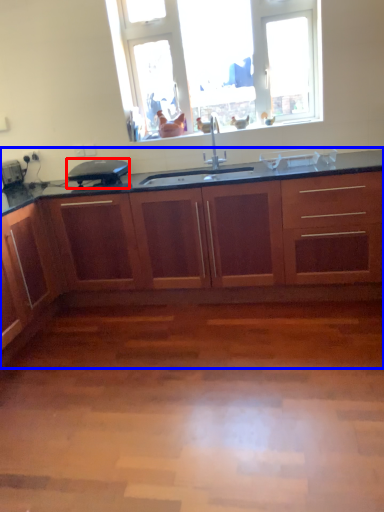
Question: Which object is closer to the camera taking this photo, appliance (highlighted by a red box) or cabinetry (highlighted by a blue box)?

Choices:
 (A) appliance
 (B) cabinetry

Answer: (B)